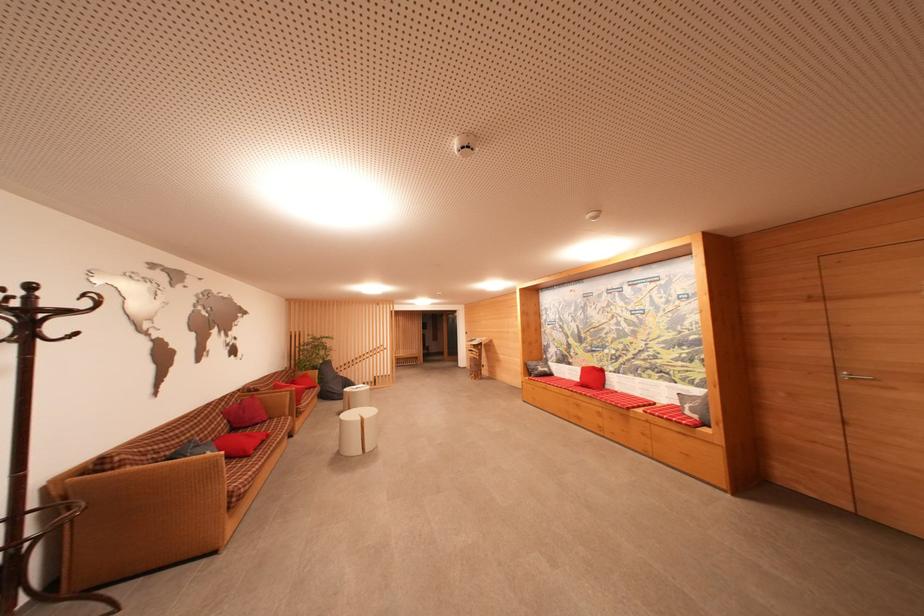
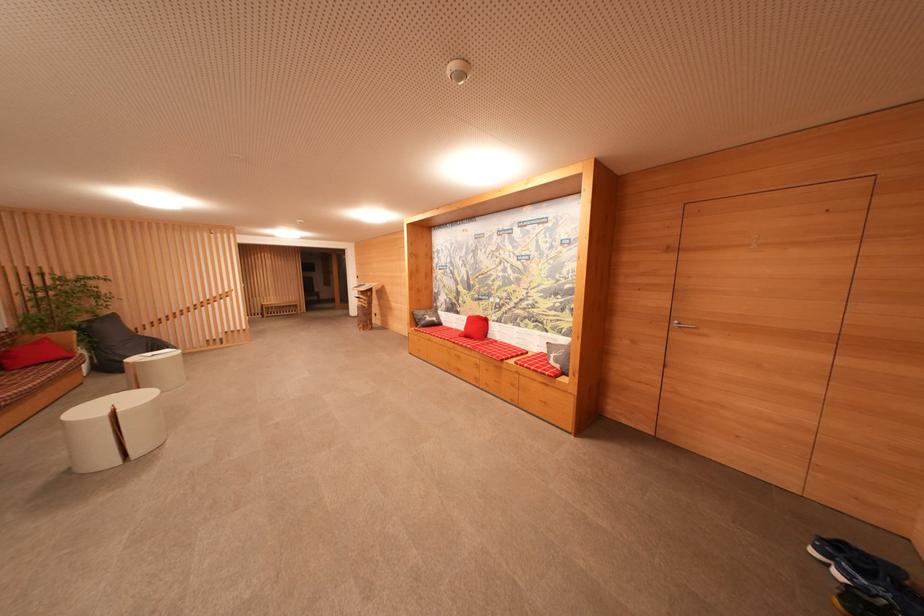
In the second image, find the point that corresponds to (x=544, y=371) in the first image.

(432, 322)